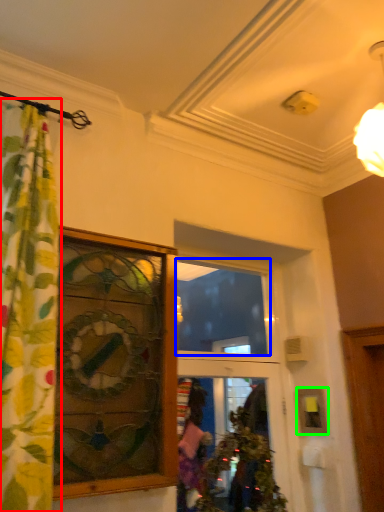
Question: Estimate the real-world distances between objects in this image. Which object is farther from curtain (highlighted by a red box), glass window (highlighted by a blue box) or picture frame (highlighted by a green box)?

Choices:
 (A) glass window
 (B) picture frame

Answer: (A)